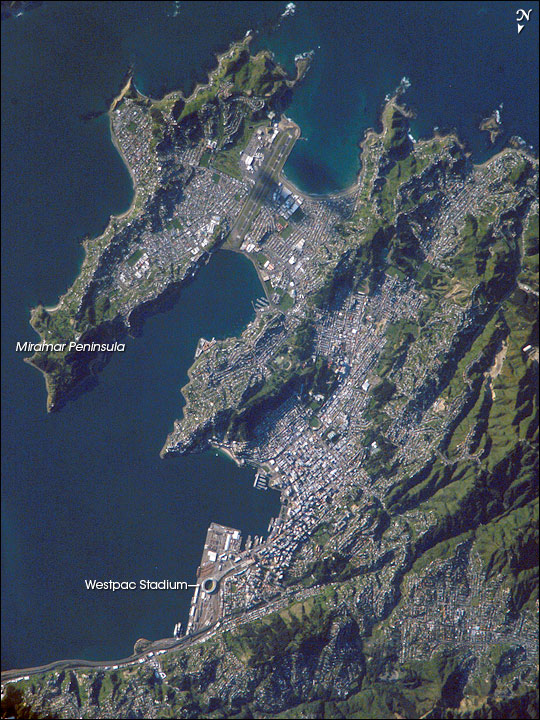
I want to click on white roof, so click(249, 161).